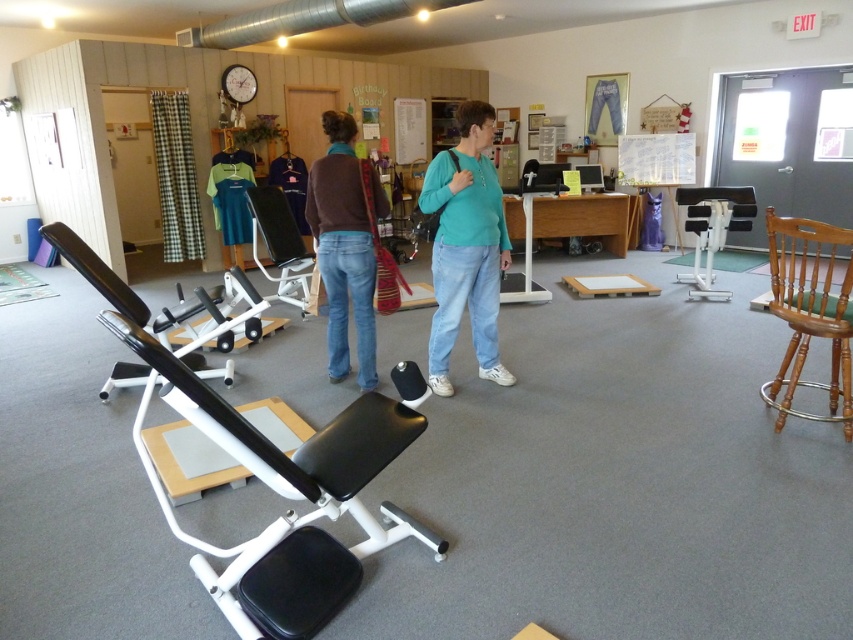
Can you confirm if teal matte shirt at center is wider than black plastic exercise bench at center?

Incorrect, teal matte shirt at center's width does not surpass black plastic exercise bench at center's.

Based on the photo, does teal matte shirt at center lie behind black plastic exercise bench at center?

No, it is in front of black plastic exercise bench at center.

Who is more distant from viewer, [442,232] or [251,188]?

The point [251,188] is behind.

This screenshot has height=640, width=853. What are the coordinates of `teal matte shirt at center` in the screenshot? It's located at (466, 248).

Does brown cotton sweater at center appear on the left side of light brown wooden chair at right?

Yes, brown cotton sweater at center is to the left of light brown wooden chair at right.

Between brown cotton sweater at center and light brown wooden chair at right, which one appears on the right side from the viewer's perspective?

light brown wooden chair at right

This screenshot has width=853, height=640. I want to click on brown cotton sweater at center, so click(x=343, y=248).

Is teal matte shirt at center taller than white plastic chair at right?

Yes.

Does teal matte shirt at center come behind white plastic chair at right?

That is False.

Is point (468, 192) closer to viewer compared to point (721, 195)?

Yes.

At what (x,y) coordinates should I click in order to perform the action: click on teal matte shirt at center. Please return your answer as a coordinate pair (x, y). Looking at the image, I should click on (466, 248).